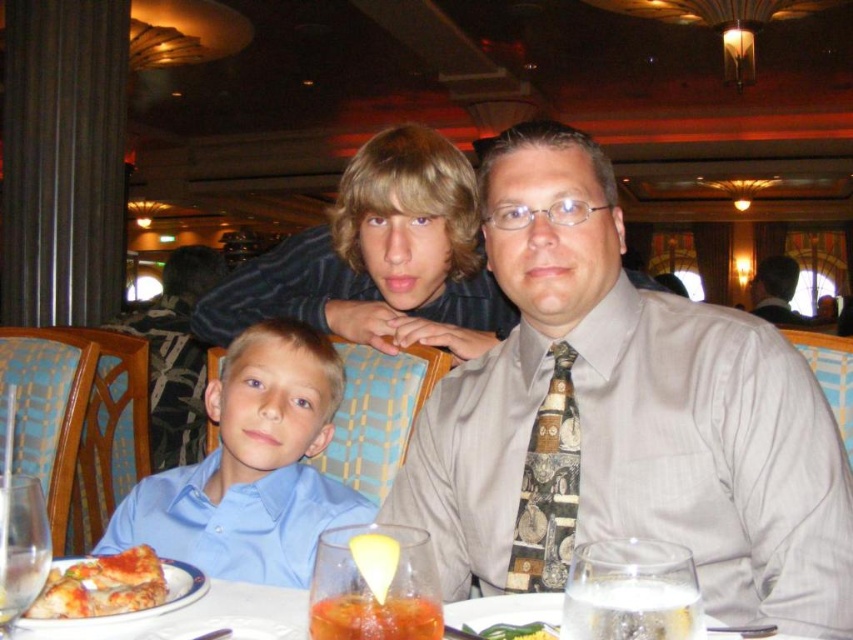
Question: Among these points, which one is farthest from the camera?

Choices:
 (A) (486, 225)
 (B) (531, 570)
 (C) (440, 611)
 (D) (318, 420)

Answer: (D)

Question: Which object is farther from the camera taking this photo?

Choices:
 (A) blue smooth shirt at lower left
 (B) matte gray shirt at center
 (C) light brown leather jacket at upper right
 (D) golden crispy pizza slice at lower left

Answer: (C)

Question: Among these objects, which one is nearest to the camera?

Choices:
 (A) clear plastic glasses at center
 (B) light brown leather jacket at upper right
 (C) matte gray shirt at center
 (D) printed silk tie at center

Answer: (C)

Question: Is printed silk tie at center thinner than golden crispy pizza slice at lower left?

Choices:
 (A) yes
 (B) no

Answer: (A)

Question: Is blue smooth shirt at lower left to the left of golden crispy pizza slice at lower left from the viewer's perspective?

Choices:
 (A) no
 (B) yes

Answer: (A)

Question: Observing the image, what is the correct spatial positioning of printed silk tie at center in reference to golden crispy pizza slice at lower left?

Choices:
 (A) above
 (B) below

Answer: (A)